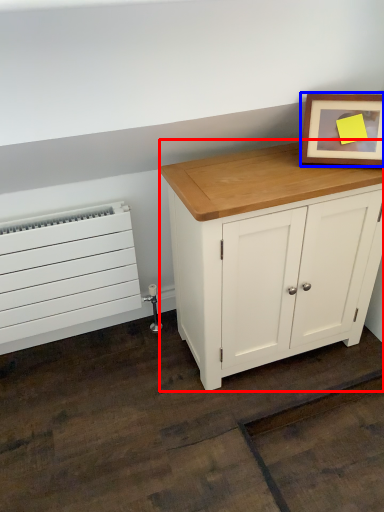
Question: Which point is closer to the camera, chest of drawers (highlighted by a red box) or picture frame (highlighted by a blue box)?

Choices:
 (A) chest of drawers
 (B) picture frame

Answer: (A)